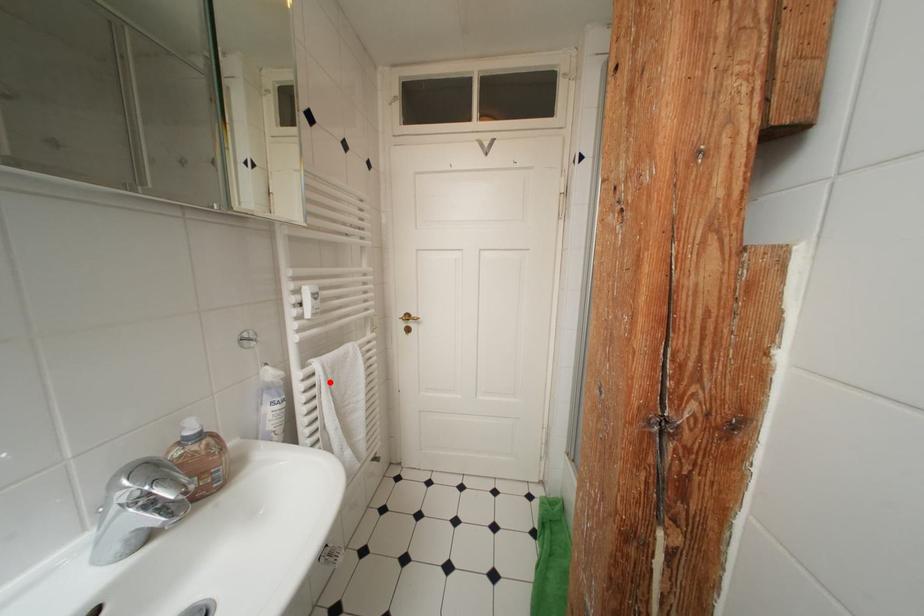
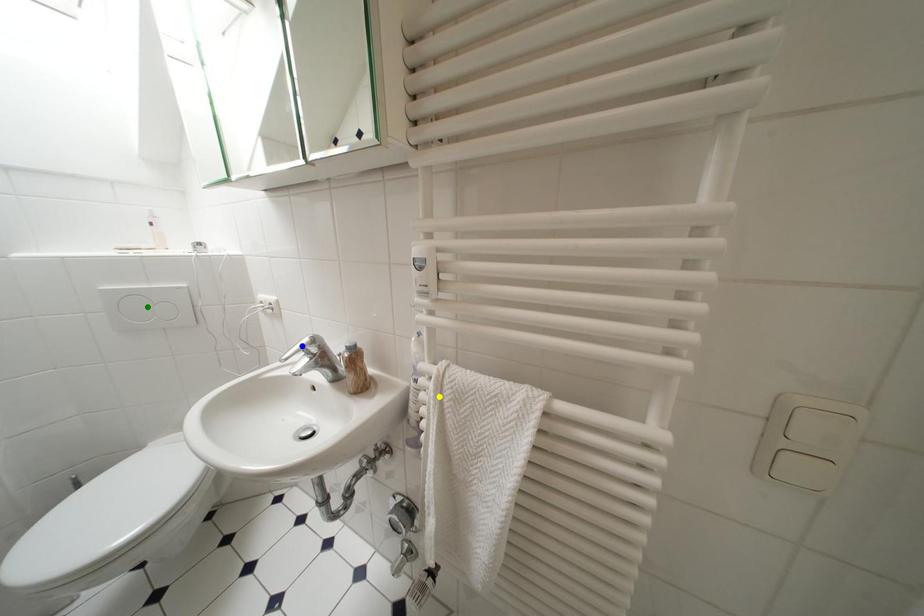
Question: I am providing you with two images of the same scene from different viewpoints. A red point is marked on the first image. You are given multiple points on the second image. Which point in image 2 is actually the same real-world point as the red point in image 1?

Choices:
 (A) green point
 (B) yellow point
 (C) blue point

Answer: (B)